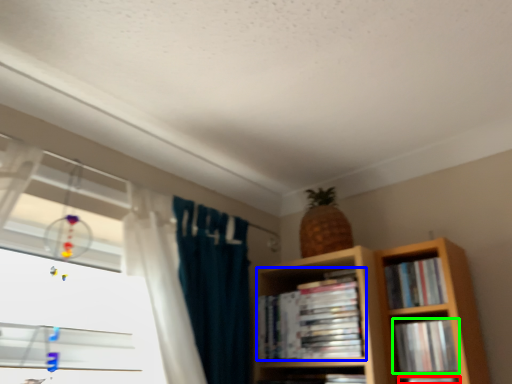
Question: Estimate the real-world distances between objects in this image. Which object is closer to book (highlighted by a red box), book (highlighted by a blue box) or book (highlighted by a green box)?

Choices:
 (A) book
 (B) book

Answer: (B)